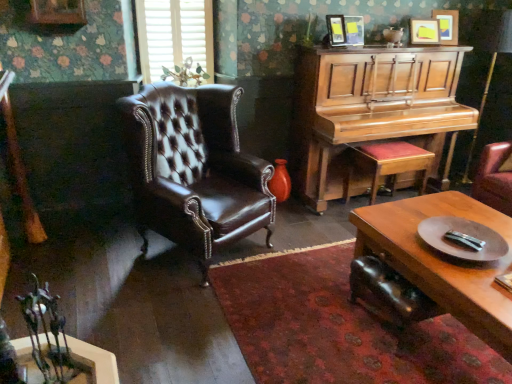
Question: From their relative heights in the image, would you say wooden stool with red cushion at right is taller or shorter than wooden piano at right?

Choices:
 (A) short
 (B) tall

Answer: (A)

Question: In terms of size, does wooden stool with red cushion at right appear bigger or smaller than wooden piano at right?

Choices:
 (A) small
 (B) big

Answer: (A)

Question: Which of these objects is positioned farthest from the wooden polished coffee table at lower right?

Choices:
 (A) matte wooden picture frame at upper center, acting as the second picture frame starting from the left
 (B) white matte blinds at upper left
 (C) wooden picture frame at upper right, the 2th picture frame in the right-to-left sequence
 (D) wooden piano at right
 (E) brown leather chair at left

Answer: (B)

Question: Which object is the closest to the brown leather chair at left?

Choices:
 (A) wooden polished coffee table at lower right
 (B) wooden polished round table at lower right
 (C) wooden picture frame at upper right, the 2th picture frame in the right-to-left sequence
 (D) matte wooden picture frame at upper center, acting as the second picture frame starting from the left
 (E) wooden stool with red cushion at right

Answer: (A)